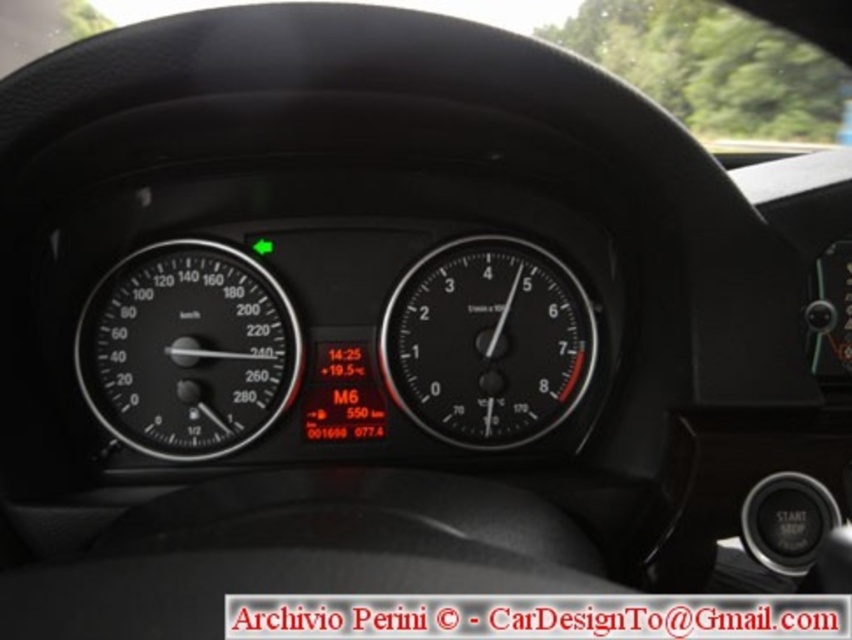
Describe the element at coordinates (487, 342) in the screenshot. I see `black matte speedometer at center` at that location.

Does black matte speedometer at center have a larger size compared to transparent glass windshield at upper center?

Incorrect, black matte speedometer at center is not larger than transparent glass windshield at upper center.

Does point (442, 408) come in front of point (652, 42)?

Yes.

This screenshot has width=852, height=640. Find the location of `black matte speedometer at center`. black matte speedometer at center is located at coordinates (487, 342).

Does black matte speedometer at left have a greater height compared to black matte speedometer at center?

No.

Identify the location of black matte speedometer at left. (187, 349).

Who is more forward, (200, 272) or (504, 312)?

Point (200, 272)

This screenshot has width=852, height=640. In order to click on black matte speedometer at left in this screenshot , I will do `click(187, 349)`.

Which of these two, black matte speedometer at left or transparent glass windshield at upper center, stands shorter?

Standing shorter between the two is transparent glass windshield at upper center.

Locate an element on the screen. This screenshot has width=852, height=640. black matte speedometer at left is located at coordinates (187, 349).